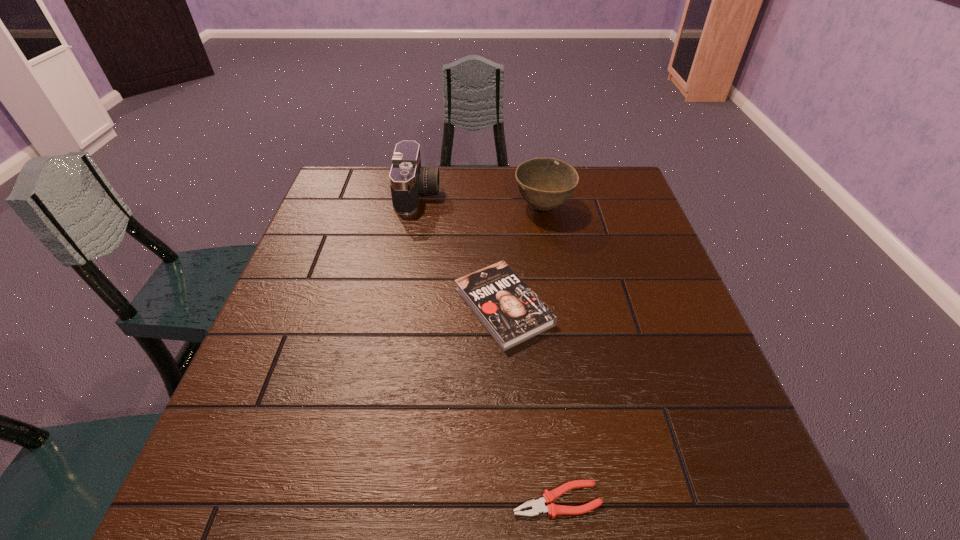
The width and height of the screenshot is (960, 540). Find the location of `object that is the second closest one to the shortest object`. object that is the second closest one to the shortest object is located at coordinates (545, 183).

In order to click on free space in the image that satisfies the following two spatial constraints: 1. on the front side of the pliers; 2. on the right side of the book in this screenshot , I will do `click(514, 500)`.

This screenshot has height=540, width=960. What are the coordinates of `vacant space that satisfies the following two spatial constraints: 1. on the front-facing side of the leftmost object; 2. on the back side of the pliers` in the screenshot? It's located at (364, 500).

What are the coordinates of `free location that satisfies the following two spatial constraints: 1. on the front-facing side of the camera; 2. on the right side of the book` in the screenshot? It's located at (398, 307).

Identify the location of free region that satisfies the following two spatial constraints: 1. on the front-facing side of the camera; 2. on the left side of the bowl. (416, 207).

Find the location of `vacant point that satisfies the following two spatial constraints: 1. on the front-facing side of the leftmost object; 2. on the left side of the book`. vacant point that satisfies the following two spatial constraints: 1. on the front-facing side of the leftmost object; 2. on the left side of the book is located at coordinates (398, 307).

Image resolution: width=960 pixels, height=540 pixels. Identify the location of free spot that satisfies the following two spatial constraints: 1. on the front-facing side of the camera; 2. on the back side of the shortest object. (364, 500).

The height and width of the screenshot is (540, 960). What are the coordinates of `free space that satisfies the following two spatial constraints: 1. on the back side of the bowl; 2. on the front-facing side of the leftmost object` in the screenshot? It's located at (541, 194).